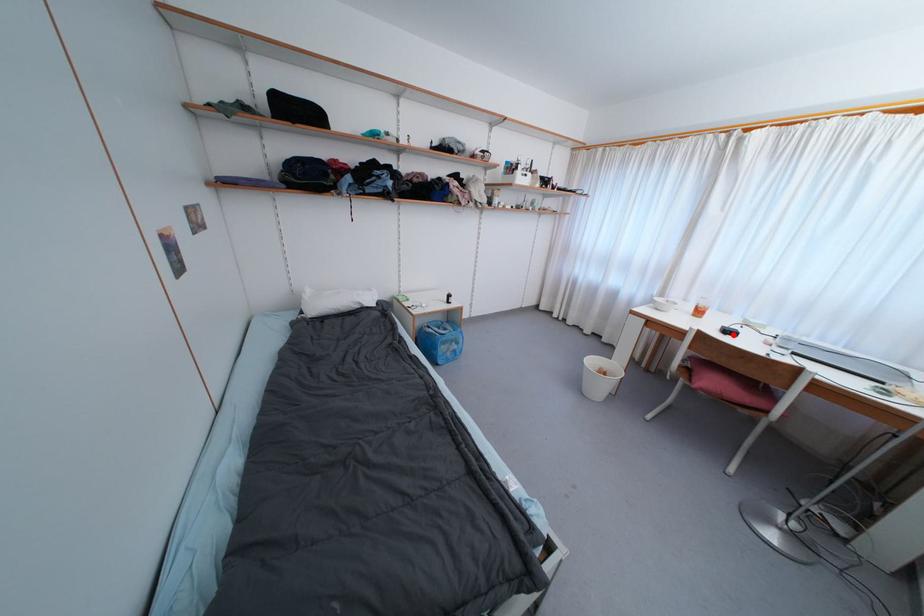
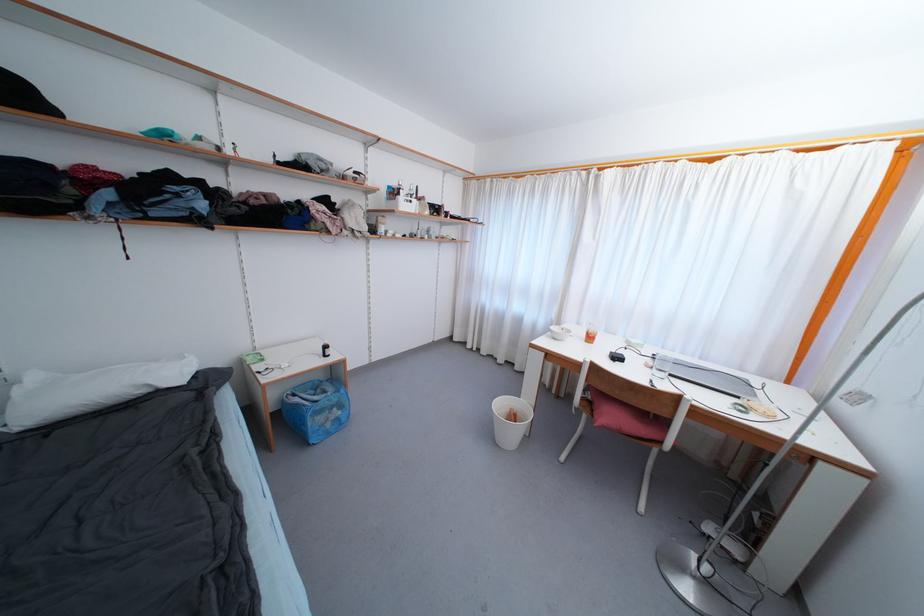
In the second image, find the point that corresponds to the highlighted location in the first image.

(621, 361)